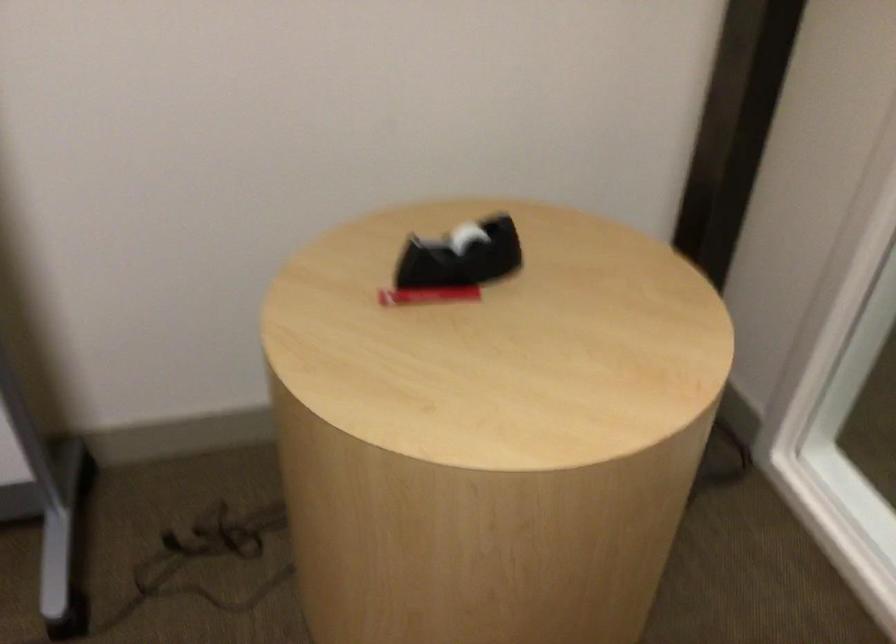
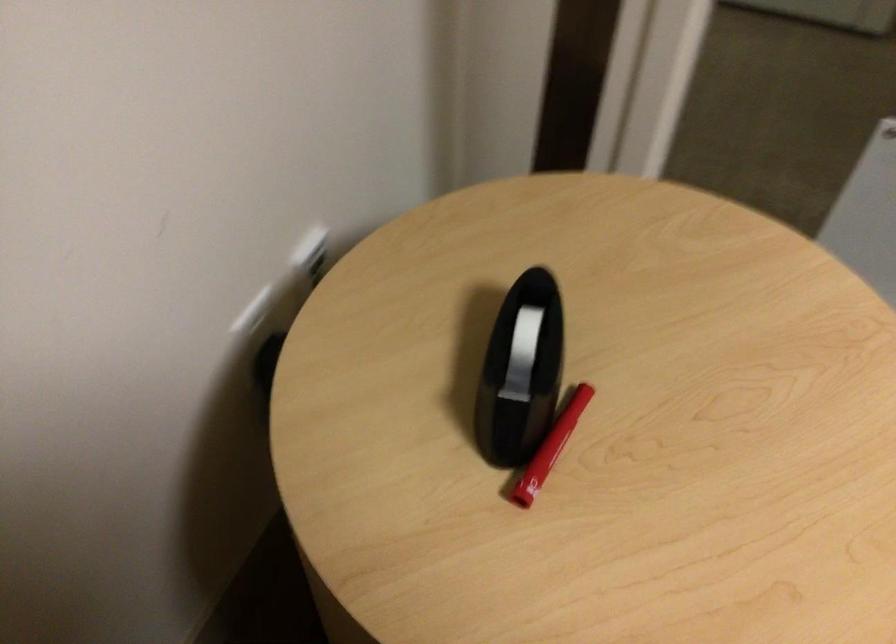
Find the pixel in the second image that matches pixel 421 290 in the first image.

(557, 438)